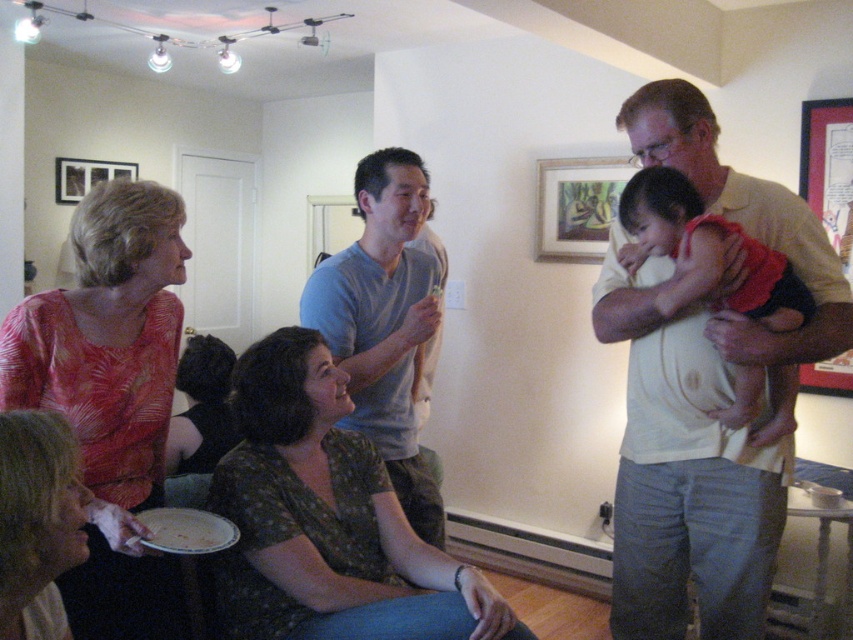
Based on the scene description, where is the green floral shirt at center located in terms of coordinates?

The green floral shirt at center is located at coordinates point (x=328, y=518).